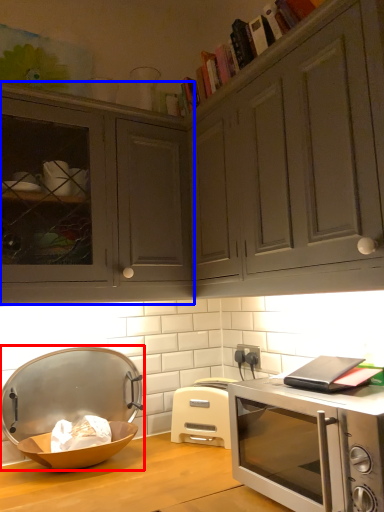
Question: Which object appears farthest to the camera in this image, appliance (highlighted by a red box) or cabinetry (highlighted by a blue box)?

Choices:
 (A) appliance
 (B) cabinetry

Answer: (A)